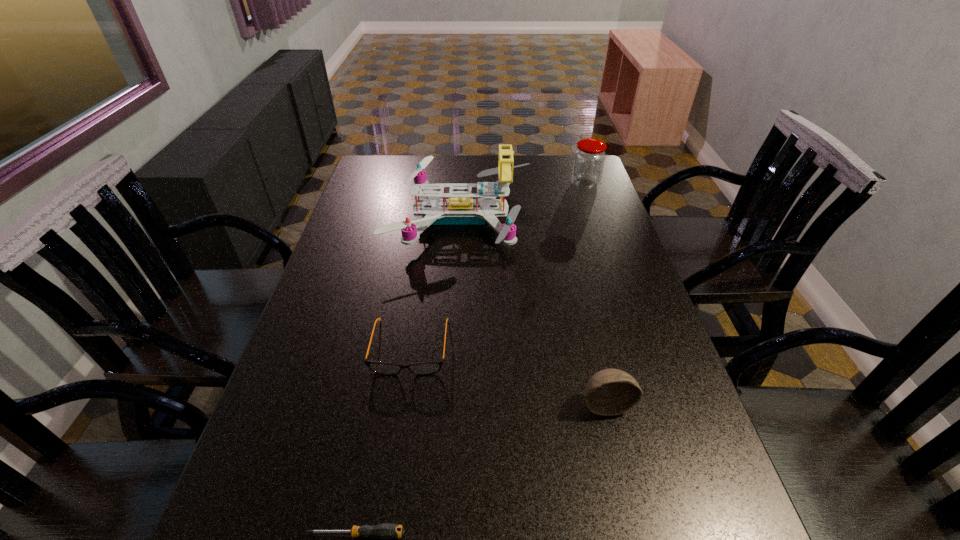
In order to click on vacant region located 0.150m on the front-facing side of the spectacles in this screenshot , I will do `click(396, 441)`.

You are a GUI agent. You are given a task and a screenshot of the screen. Output one action in this format:
    pyautogui.click(x=<x>, y=<y>)
    Task: Click on the drone that is positioned at the far edge
    
    Given the screenshot: What is the action you would take?
    pyautogui.click(x=460, y=209)

The image size is (960, 540). Identify the location of jar positioned at the far edge. (589, 158).

Locate an element on the screen. Image resolution: width=960 pixels, height=540 pixels. object present at the left edge is located at coordinates (460, 209).

At what (x,y) coordinates should I click in order to perform the action: click on jar located in the right edge section of the desktop. Please return your answer as a coordinate pair (x, y). This screenshot has height=540, width=960. Looking at the image, I should click on (589, 158).

Where is `bowl present at the right edge`? This screenshot has width=960, height=540. bowl present at the right edge is located at coordinates (609, 392).

The image size is (960, 540). In order to click on object situated at the far left corner in this screenshot , I will do `click(460, 209)`.

You are a GUI agent. You are given a task and a screenshot of the screen. Output one action in this format:
    pyautogui.click(x=<x>, y=<y>)
    Task: Click on the object that is at the far right corner
    The height and width of the screenshot is (540, 960).
    Given the screenshot: What is the action you would take?
    pyautogui.click(x=589, y=158)

In order to click on vacant space at the far edge of the desktop in this screenshot , I will do `click(543, 181)`.

Where is `blank space at the left edge`? The height and width of the screenshot is (540, 960). blank space at the left edge is located at coordinates (330, 252).